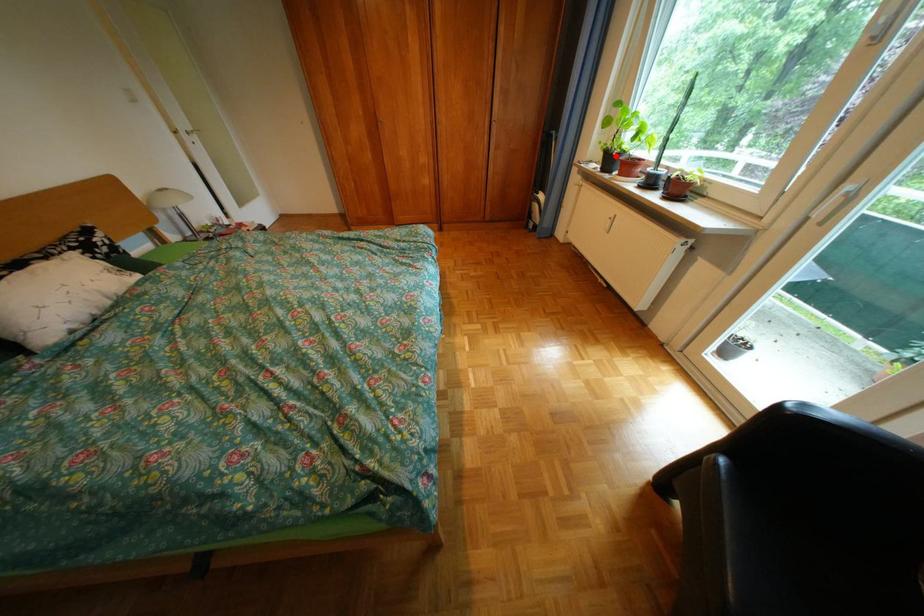
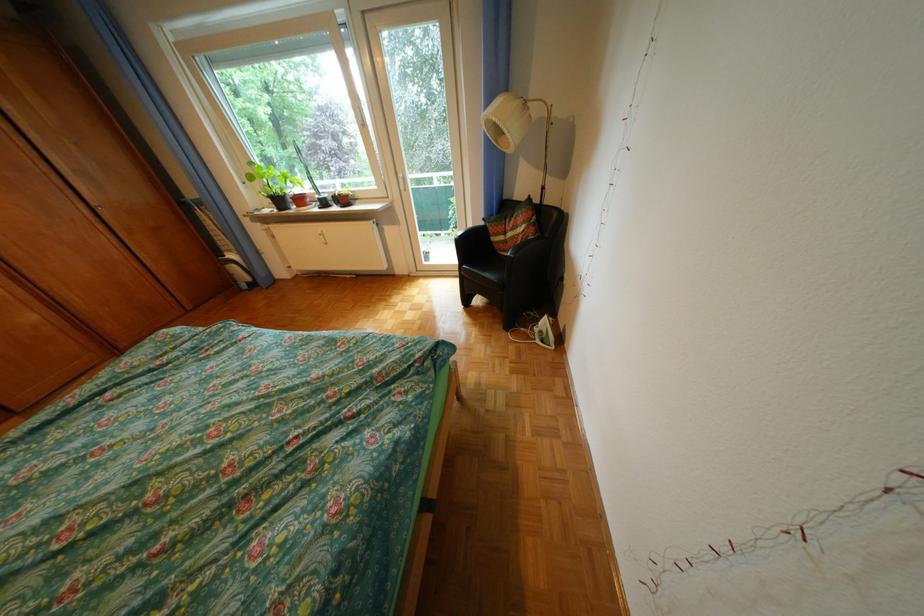
Locate, in the second image, the point that corresponds to the highlighted location in the first image.

(284, 201)